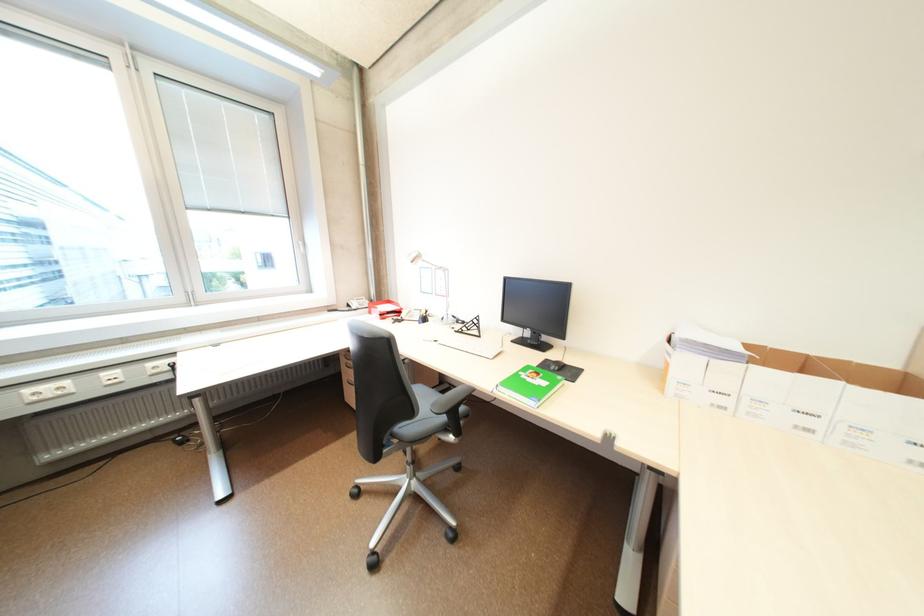
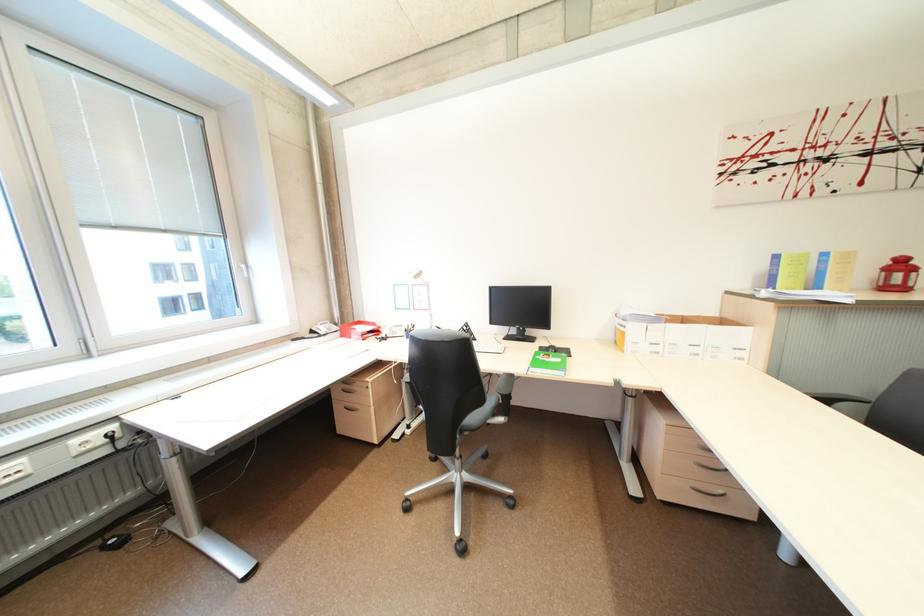
Locate, in the second image, the point that corresponds to point 358,306 in the first image.

(321, 333)